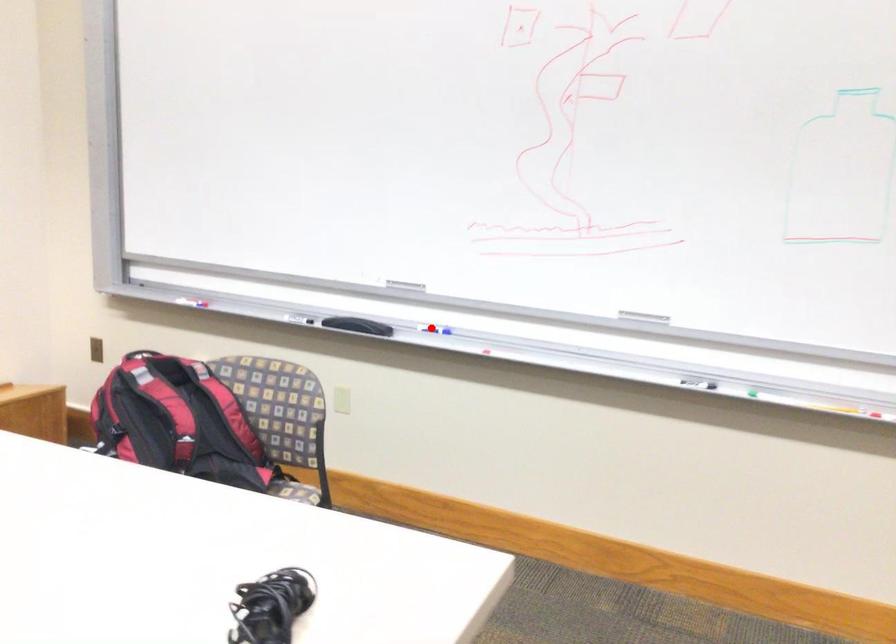
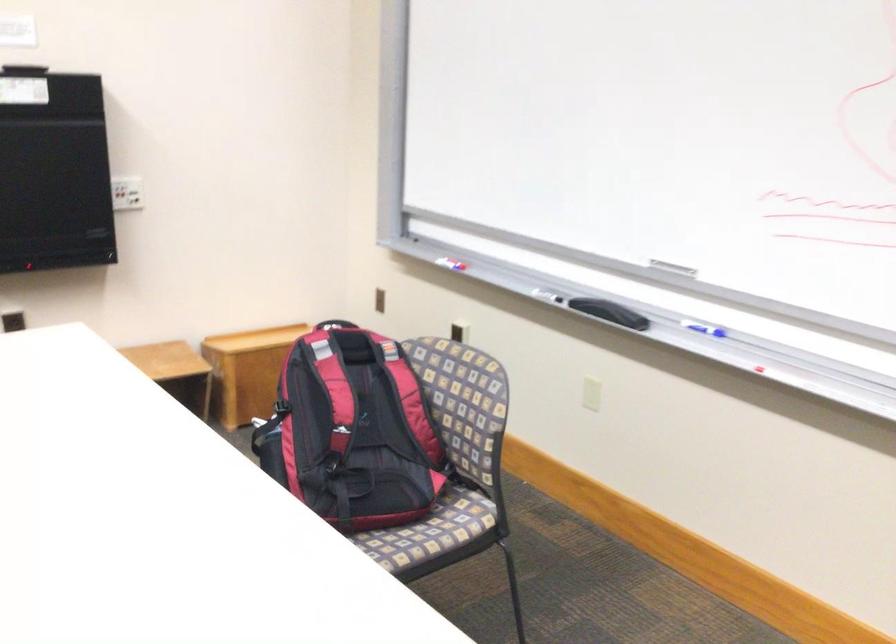
In the second image, find the point that corresponds to the highlighted location in the first image.

(702, 328)